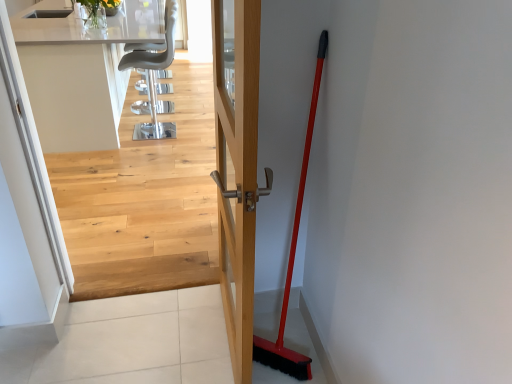
This screenshot has height=384, width=512. Describe the element at coordinates (153, 74) in the screenshot. I see `metallic gray chair at upper center` at that location.

This screenshot has width=512, height=384. Describe the element at coordinates (293, 257) in the screenshot. I see `red plastic shovel at right` at that location.

What do you see at coordinates (80, 71) in the screenshot? The height and width of the screenshot is (384, 512). I see `white glossy countertop at upper center` at bounding box center [80, 71].

This screenshot has height=384, width=512. I want to click on metallic gray chair at upper center, so click(x=153, y=74).

Is white glossy countertop at upper center wider than red plastic shovel at right?

Correct, the width of white glossy countertop at upper center exceeds that of red plastic shovel at right.

From a real-world perspective, is white glossy countertop at upper center physically below red plastic shovel at right?

Yes, from a real-world perspective, white glossy countertop at upper center is under red plastic shovel at right.

Is white glossy countertop at upper center facing towards red plastic shovel at right?

No, white glossy countertop at upper center is not aimed at red plastic shovel at right.

How distant is white glossy countertop at upper center from red plastic shovel at right?

white glossy countertop at upper center and red plastic shovel at right are 2.36 meters apart from each other.

What's the angular difference between light wood floor at upper center and white glossy countertop at upper center's facing directions?

90.2 degrees.

Is light wood floor at upper center surrounding white glossy countertop at upper center?

No, white glossy countertop at upper center is not a part of light wood floor at upper center.

Is point (91, 172) closer or farther from the camera than point (86, 49)?

Point (91, 172) appears to be farther away from the viewer than point (86, 49).

Can you confirm if light wood floor at upper center is smaller than white glossy countertop at upper center?

Yes, light wood floor at upper center is smaller than white glossy countertop at upper center.

Does metallic gray chair at upper center have a lesser width compared to wooden door handle at center?

No, metallic gray chair at upper center is not thinner than wooden door handle at center.

Is metallic gray chair at upper center next to wooden door handle at center?

No, metallic gray chair at upper center is not touching wooden door handle at center.

Is metallic gray chair at upper center shorter than wooden door handle at center?

Indeed, metallic gray chair at upper center has a lesser height compared to wooden door handle at center.

Which of these two, white glossy countertop at upper center or light wood floor at upper center, is bigger?

white glossy countertop at upper center is bigger.

From the image's perspective, which one is positioned lower, white glossy countertop at upper center or light wood floor at upper center?

light wood floor at upper center, from the image's perspective.

Is white glossy countertop at upper center wider or thinner than light wood floor at upper center?

Clearly, white glossy countertop at upper center has more width compared to light wood floor at upper center.

From the picture: From a real-world perspective, between white glossy countertop at upper center and light wood floor at upper center, who is vertically lower?

From a 3D spatial view, white glossy countertop at upper center is below.

From a real-world perspective, is wooden door handle at center positioned above or below white glossy countertop at upper center?

In terms of real-world spatial position, wooden door handle at center is above white glossy countertop at upper center.

Does point (230, 146) come farther from viewer compared to point (97, 101)?

No, it is in front of (97, 101).

Is wooden door handle at center positioned behind white glossy countertop at upper center?

No, wooden door handle at center is closer to the viewer.

Who is taller, wooden door handle at center or white glossy countertop at upper center?

wooden door handle at center.

Does white glossy countertop at upper center have a smaller size compared to metallic gray chair at upper center?

No, white glossy countertop at upper center is not smaller than metallic gray chair at upper center.

Which is in front, white glossy countertop at upper center or metallic gray chair at upper center?

white glossy countertop at upper center is in front.

From the picture: Is white glossy countertop at upper center inside or outside of metallic gray chair at upper center?

white glossy countertop at upper center is not inside metallic gray chair at upper center, it's outside.

Measure the distance between white glossy countertop at upper center and metallic gray chair at upper center.

A distance of 29.29 inches exists between white glossy countertop at upper center and metallic gray chair at upper center.

From the image's perspective, is light wood floor at upper center below red plastic shovel at right?

Actually, light wood floor at upper center appears above red plastic shovel at right in the image.

In the scene shown: Between light wood floor at upper center and red plastic shovel at right, which one appears on the left side from the viewer's perspective?

light wood floor at upper center.

Where is `shovel below the white glossy countertop at upper center (from the image's perspective)`? shovel below the white glossy countertop at upper center (from the image's perspective) is located at coordinates (293, 257).

This screenshot has width=512, height=384. Find the location of `stairwell that appears in front of the white glossy countertop at upper center`. stairwell that appears in front of the white glossy countertop at upper center is located at coordinates (144, 201).

Which object lies nearer to the anchor point metallic gray chair at upper center, light wood floor at upper center or red plastic shovel at right?

light wood floor at upper center is closer to metallic gray chair at upper center.

Estimate the real-world distances between objects in this image. Which object is further from red plastic shovel at right, light wood floor at upper center or white glossy countertop at upper center?

white glossy countertop at upper center.

Considering their positions, is white glossy countertop at upper center positioned further to metallic gray chair at upper center than red plastic shovel at right?

red plastic shovel at right.

Considering their positions, is wooden door handle at center positioned closer to light wood floor at upper center than red plastic shovel at right?

wooden door handle at center.

Estimate the real-world distances between objects in this image. Which object is further from red plastic shovel at right, wooden door handle at center or light wood floor at upper center?

light wood floor at upper center is positioned further to the anchor red plastic shovel at right.

Estimate the real-world distances between objects in this image. Which object is further from white glossy countertop at upper center, wooden door handle at center or red plastic shovel at right?

red plastic shovel at right is positioned further to the anchor white glossy countertop at upper center.

Considering their positions, is wooden door handle at center positioned closer to metallic gray chair at upper center than light wood floor at upper center?

light wood floor at upper center is positioned closer to the anchor metallic gray chair at upper center.

When comparing their distances from white glossy countertop at upper center, does wooden door handle at center or metallic gray chair at upper center seem further?

The object further to white glossy countertop at upper center is wooden door handle at center.

You are a GUI agent. You are given a task and a screenshot of the screen. Output one action in this format:
    pyautogui.click(x=<x>, y=<y>)
    Task: Click on the shovel between wooden door handle at center and white glossy countertop at upper center from front to back
    The height and width of the screenshot is (384, 512).
    Given the screenshot: What is the action you would take?
    pyautogui.click(x=293, y=257)

What are the coordinates of `stairwell positioned between wooden door handle at center and white glossy countertop at upper center from near to far` in the screenshot? It's located at tap(144, 201).

You are a GUI agent. You are given a task and a screenshot of the screen. Output one action in this format:
    pyautogui.click(x=<x>, y=<y>)
    Task: Click on the counter top between red plastic shovel at right and metallic gray chair at upper center in the front-back direction
    The height and width of the screenshot is (384, 512).
    Given the screenshot: What is the action you would take?
    pyautogui.click(x=80, y=71)

This screenshot has width=512, height=384. I want to click on stairwell between wooden door handle at center and metallic gray chair at upper center in the front-back direction, so click(x=144, y=201).